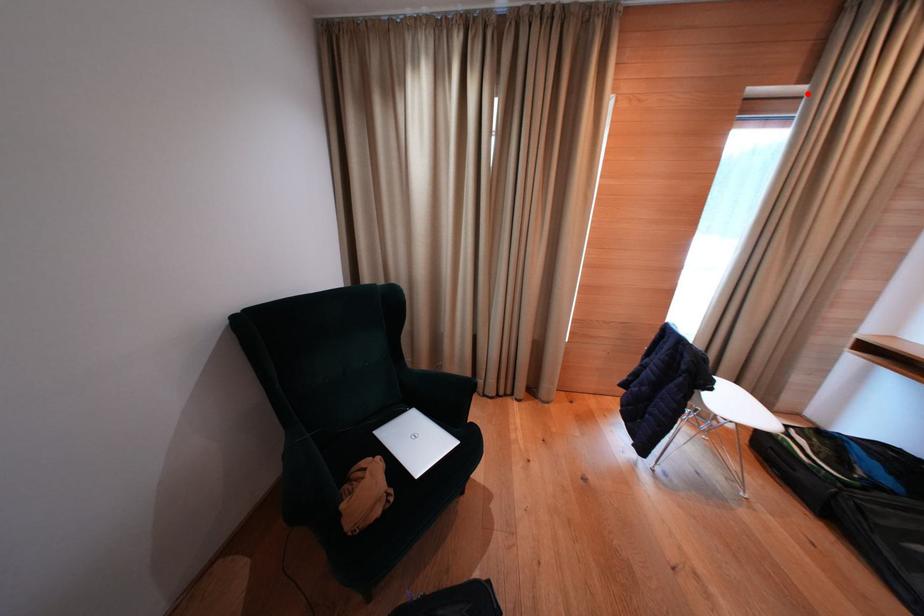
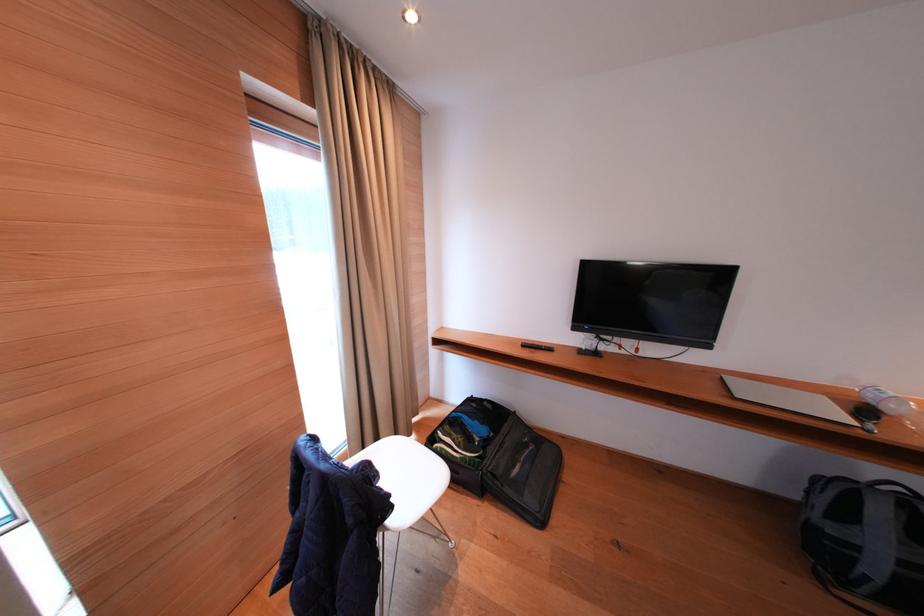
Question: I am providing you with two images of the same scene from different viewpoints. A red point is marked on the first image. At the location where the point appears in image 1, is it still visible in image 2?

Choices:
 (A) Yes
 (B) No

Answer: (A)